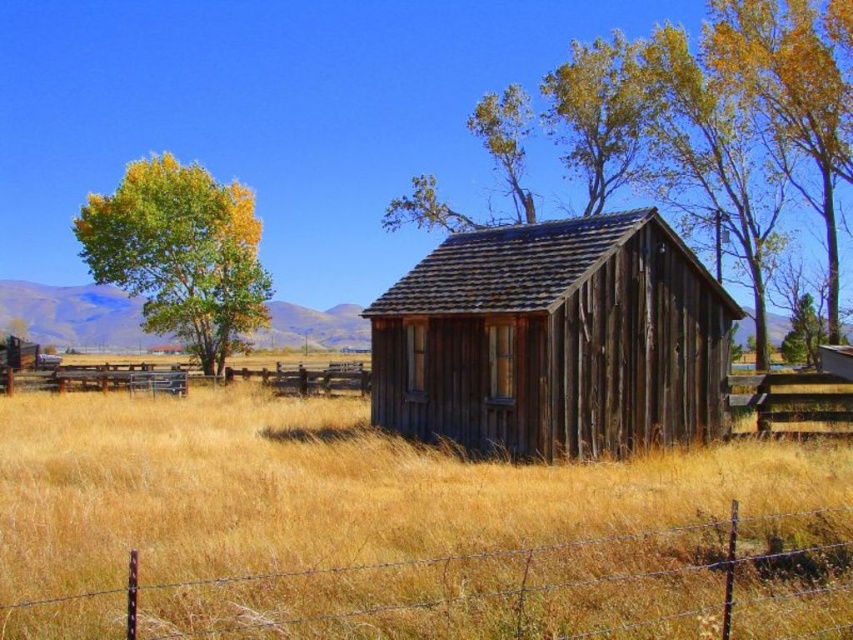
Question: Is green leafy tree at left positioned at the back of yellow leafy tree at upper right?

Choices:
 (A) yes
 (B) no

Answer: (A)

Question: Which object is farther from the camera taking this photo?

Choices:
 (A) yellow-green foliage at upper center
 (B) weathered wood barn at center
 (C) green leafy tree at left
 (D) brown wire fence at lower center

Answer: (C)

Question: Which of the following is the farthest from the observer?

Choices:
 (A) pyautogui.click(x=332, y=368)
 (B) pyautogui.click(x=740, y=124)
 (C) pyautogui.click(x=720, y=422)

Answer: (B)

Question: Does yellow-green foliage at upper center appear over yellow leafy tree at upper right?

Choices:
 (A) yes
 (B) no

Answer: (A)

Question: Can you confirm if yellow-green foliage at upper center is positioned above green leafy tree at left?

Choices:
 (A) no
 (B) yes

Answer: (B)

Question: Which point is closer to the camera?

Choices:
 (A) yellow leafy tree at upper right
 (B) green leafy tree at left
 (C) yellow-green foliage at upper center
 (D) green rough bark tree at center

Answer: (C)